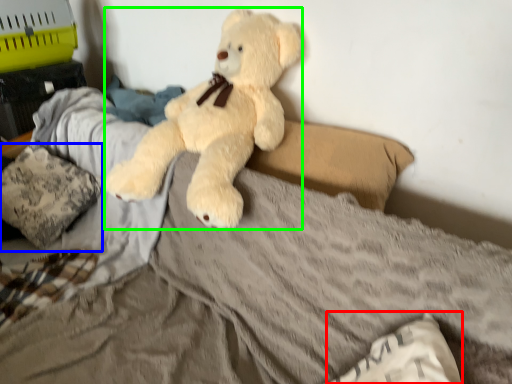
Question: Based on their relative distances, which object is farther from pillow (highlighted by a red box)? Choose from pillow (highlighted by a blue box) and teddy bear (highlighted by a green box).

Choices:
 (A) pillow
 (B) teddy bear

Answer: (A)